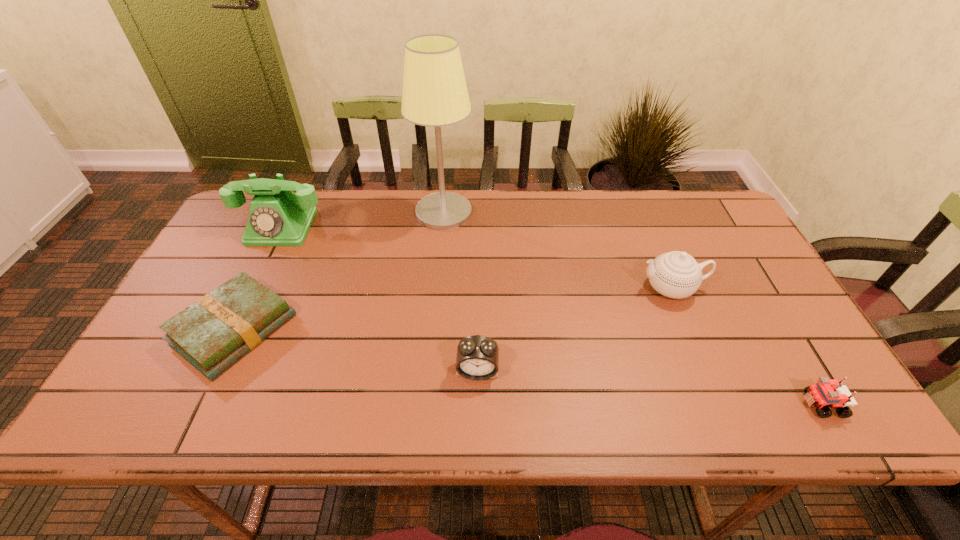
Point out which object is positioned as the second nearest to the tallest object. Please provide its 2D coordinates. Your answer should be formatted as a tuple, i.e. [(x, y)], where the tuple contains the x and y coordinates of a point satisfying the conditions above.

[(213, 333)]

Identify which object is located as the fourth nearest to the book. Please provide its 2D coordinates. Your answer should be formatted as a tuple, i.e. [(x, y)], where the tuple contains the x and y coordinates of a point satisfying the conditions above.

[(675, 274)]

Where is `blank space that satisfies the following two spatial constraints: 1. on the dial of the second tallest object; 2. on the left side of the book`? The height and width of the screenshot is (540, 960). blank space that satisfies the following two spatial constraints: 1. on the dial of the second tallest object; 2. on the left side of the book is located at coordinates (231, 329).

Locate an element on the screen. This screenshot has height=540, width=960. free space that satisfies the following two spatial constraints: 1. on the dial of the fifth shortest object; 2. on the left side of the shortest object is located at coordinates (231, 329).

The image size is (960, 540). In order to click on free region that satisfies the following two spatial constraints: 1. on the back side of the table lamp; 2. on the right side of the shortest object in this screenshot , I will do `click(291, 212)`.